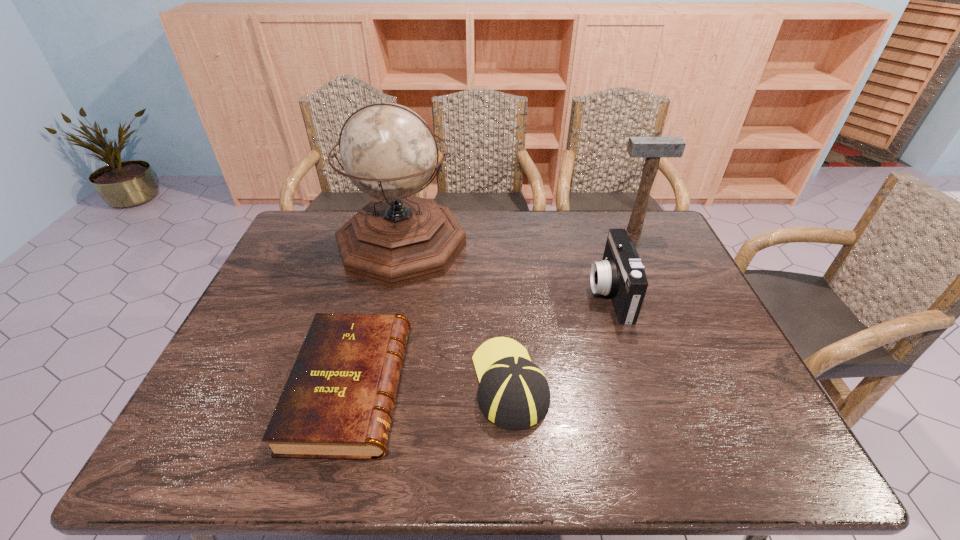
This screenshot has height=540, width=960. I want to click on globe, so click(x=388, y=151).

This screenshot has width=960, height=540. What are the coordinates of `mallet` in the screenshot? It's located at (652, 148).

Locate an element on the screen. The height and width of the screenshot is (540, 960). the fourth shortest object is located at coordinates (652, 148).

This screenshot has height=540, width=960. Identify the location of the third tallest object. (620, 274).

Find the location of a particular element. Image resolution: width=960 pixels, height=540 pixels. the fourth object from left to right is located at coordinates (620, 274).

In order to click on the second shortest object in this screenshot , I will do click(513, 393).

This screenshot has width=960, height=540. In order to click on baseball cap in this screenshot , I will do `click(513, 393)`.

I want to click on the shortest object, so click(337, 403).

Where is `vacant point located on the surface of the tallest object`? vacant point located on the surface of the tallest object is located at coordinates (379, 349).

In order to click on free spot located on the left of the mallet in this screenshot , I will do `click(564, 230)`.